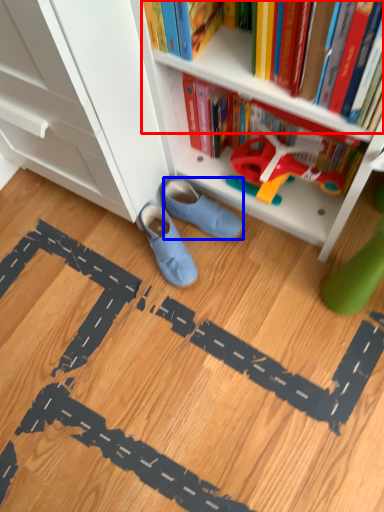
Question: Which point is closer to the camera, book (highlighted by a red box) or footwear (highlighted by a blue box)?

Choices:
 (A) book
 (B) footwear

Answer: (A)